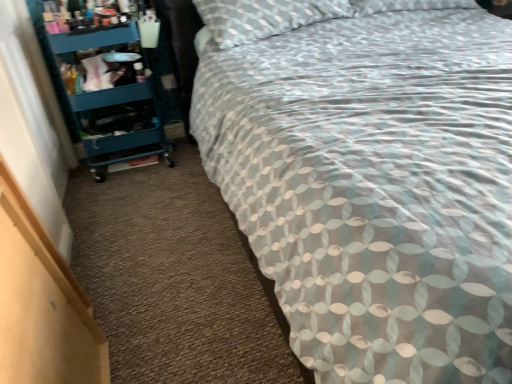
Question: Would you say teal plastic cart at left is outside patterned fabric bed at center?

Choices:
 (A) yes
 (B) no

Answer: (A)

Question: Does teal plastic cart at left have a lesser width compared to patterned fabric bed at center?

Choices:
 (A) no
 (B) yes

Answer: (B)

Question: Is teal plastic cart at left bigger than patterned fabric bed at center?

Choices:
 (A) yes
 (B) no

Answer: (B)

Question: Is the depth of teal plastic cart at left greater than that of patterned fabric bed at center?

Choices:
 (A) yes
 (B) no

Answer: (A)

Question: Is teal plastic cart at left positioned before patterned fabric bed at center?

Choices:
 (A) no
 (B) yes

Answer: (A)

Question: Is teal plastic cart at left not close to patterned fabric bed at center?

Choices:
 (A) no
 (B) yes

Answer: (A)

Question: Is teal plastic cart at left at the back of patterned fabric bed at center?

Choices:
 (A) yes
 (B) no

Answer: (B)

Question: Are patterned fabric bed at center and teal plastic cart at left far apart?

Choices:
 (A) no
 (B) yes

Answer: (A)

Question: From the image's perspective, is patterned fabric bed at center located above teal plastic cart at left?

Choices:
 (A) yes
 (B) no

Answer: (B)

Question: Could you tell me if patterned fabric bed at center is facing teal plastic cart at left?

Choices:
 (A) no
 (B) yes

Answer: (A)

Question: Does patterned fabric bed at center have a smaller size compared to teal plastic cart at left?

Choices:
 (A) yes
 (B) no

Answer: (B)

Question: Is patterned fabric bed at center to the right of teal plastic cart at left from the viewer's perspective?

Choices:
 (A) yes
 (B) no

Answer: (A)

Question: From the image's perspective, is teal plastic cart at left positioned above or below patterned fabric bed at center?

Choices:
 (A) above
 (B) below

Answer: (A)